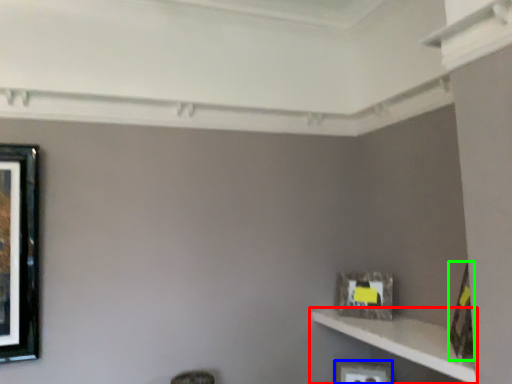
Question: Considering the real-world distances, which object is closest to shelf (highlighted by a red box)? picture frame (highlighted by a blue box) or picture frame (highlighted by a green box).

Choices:
 (A) picture frame
 (B) picture frame

Answer: (B)